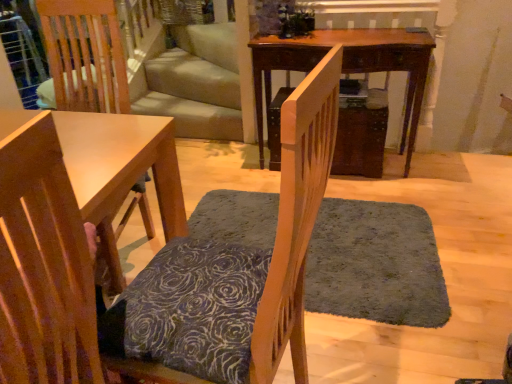
Question: Is the position of wooden chair with patterned cushion at center, which appears as the 1th chair when viewed from the right, more distant than that of mahogany wood table at center?

Choices:
 (A) yes
 (B) no

Answer: (B)

Question: Can you confirm if wooden chair with patterned cushion at center, which appears as the 1th chair when viewed from the right, is smaller than mahogany wood table at center?

Choices:
 (A) no
 (B) yes

Answer: (B)

Question: Is mahogany wood table at center located within wooden chair with patterned cushion at center, which appears as the 1th chair when viewed from the right?

Choices:
 (A) yes
 (B) no

Answer: (B)

Question: From the image's perspective, does wooden chair with patterned cushion at center, acting as the second chair starting from the left, appear lower than mahogany wood table at center?

Choices:
 (A) no
 (B) yes

Answer: (B)

Question: Can you confirm if wooden chair with patterned cushion at center, acting as the second chair starting from the left, is shorter than mahogany wood table at center?

Choices:
 (A) yes
 (B) no

Answer: (B)

Question: Which is correct: dark gray shaggy rug at center is inside mahogany wood table at center, or outside of it?

Choices:
 (A) inside
 (B) outside

Answer: (B)

Question: Considering their positions, is dark gray shaggy rug at center located in front of or behind mahogany wood table at center?

Choices:
 (A) behind
 (B) front

Answer: (B)

Question: Considering the positions of dark gray shaggy rug at center and mahogany wood table at center in the image, is dark gray shaggy rug at center bigger or smaller than mahogany wood table at center?

Choices:
 (A) big
 (B) small

Answer: (B)

Question: Is point (340, 291) positioned closer to the camera than point (406, 120)?

Choices:
 (A) farther
 (B) closer

Answer: (B)

Question: Is point (3, 238) closer or farther from the camera than point (310, 246)?

Choices:
 (A) farther
 (B) closer

Answer: (B)

Question: Is wooden chair at lower left, which ranks as the first chair in left-to-right order, inside or outside of dark gray shaggy rug at center?

Choices:
 (A) outside
 (B) inside

Answer: (A)

Question: Based on their positions, is wooden chair at lower left, which ranks as the first chair in left-to-right order, located to the left or right of dark gray shaggy rug at center?

Choices:
 (A) left
 (B) right

Answer: (A)

Question: Considering the positions of wooden chair at lower left, which ranks as the first chair in left-to-right order, and dark gray shaggy rug at center in the image, is wooden chair at lower left, which ranks as the first chair in left-to-right order, wider or thinner than dark gray shaggy rug at center?

Choices:
 (A) wide
 (B) thin

Answer: (B)

Question: Is mahogany wood table at center in front of or behind wooden chair with patterned cushion at center, which appears as the 1th chair when viewed from the right, in the image?

Choices:
 (A) front
 (B) behind

Answer: (B)

Question: From a real-world perspective, relative to wooden chair with patterned cushion at center, acting as the second chair starting from the left, is mahogany wood table at center vertically above or below?

Choices:
 (A) above
 (B) below

Answer: (B)